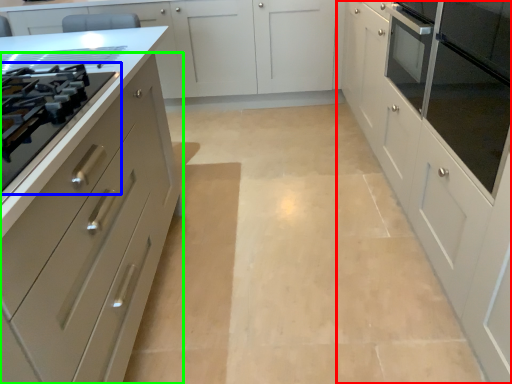
Question: Which object is the closest to the cabinetry (highlighted by a red box)? Choose among these: drawer (highlighted by a blue box) or cabinetry (highlighted by a green box).

Choices:
 (A) drawer
 (B) cabinetry

Answer: (B)